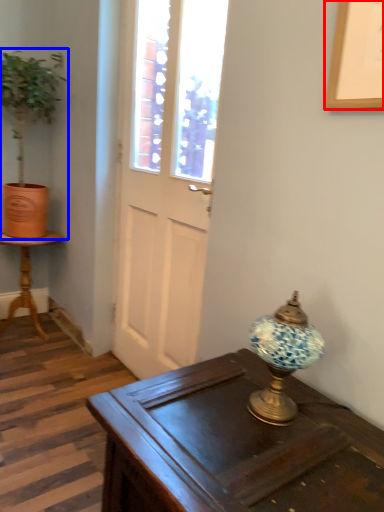
Question: Which object appears farthest to the camera in this image, picture frame (highlighted by a red box) or houseplant (highlighted by a blue box)?

Choices:
 (A) picture frame
 (B) houseplant

Answer: (B)